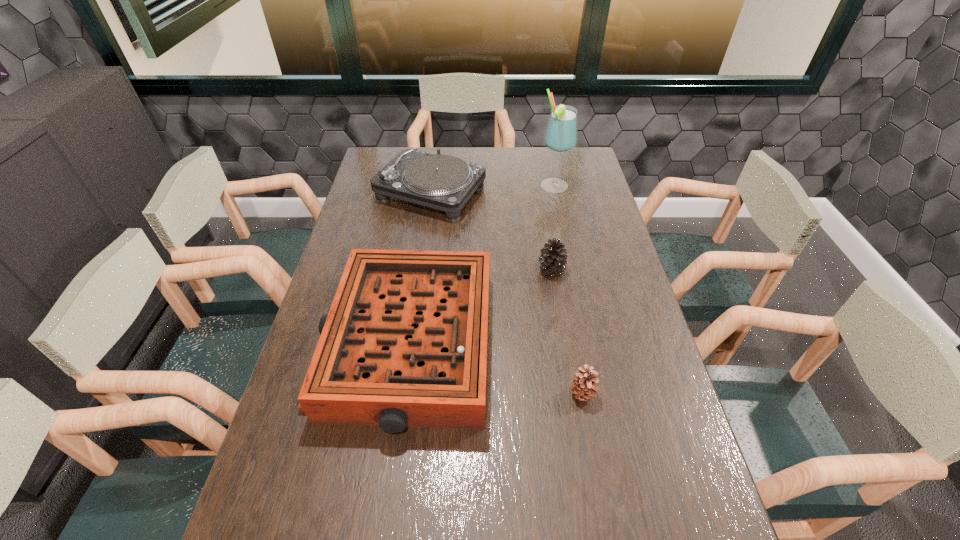
Find the location of a particular element. vacant space at the far right corner of the desktop is located at coordinates (572, 173).

Find the location of a particular element. The image size is (960, 540). empty space that is in between the alcohol and the farther pinecone is located at coordinates (553, 228).

At what (x,y) coordinates should I click in order to perform the action: click on vacant area that lies between the nearer pinecone and the record player. Please return your answer as a coordinate pair (x, y). The height and width of the screenshot is (540, 960). Looking at the image, I should click on point(507,293).

The image size is (960, 540). Identify the location of free space between the record player and the farther pinecone. point(491,231).

Image resolution: width=960 pixels, height=540 pixels. Identify the location of vacant point located between the farther pinecone and the nearer pinecone. [x=567, y=332].

You are a GUI agent. You are given a task and a screenshot of the screen. Output one action in this format:
    pyautogui.click(x=<x>, y=<y>)
    Task: Click on the empty space between the alcohol and the nearer pinecone
    This screenshot has height=540, width=960.
    Given the screenshot: What is the action you would take?
    pyautogui.click(x=568, y=290)

I want to click on free area in between the gameboard and the shorter pinecone, so click(494, 369).

Where is `object that is the third closest to the gameboard`? This screenshot has height=540, width=960. object that is the third closest to the gameboard is located at coordinates (443, 182).

Find the location of a particular element. object that can be found as the fourth closest to the gameboard is located at coordinates (x=561, y=134).

Point out which pinecone is positioned as the nearest to the gameboard. Please provide its 2D coordinates. Your answer should be formatted as a tuple, i.e. [(x, y)], where the tuple contains the x and y coordinates of a point satisfying the conditions above.

[(553, 259)]